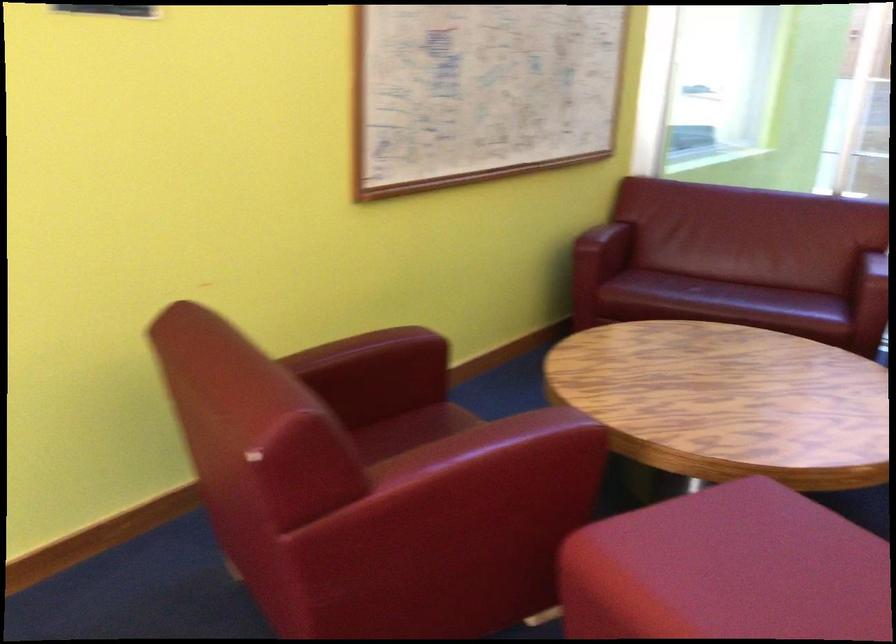
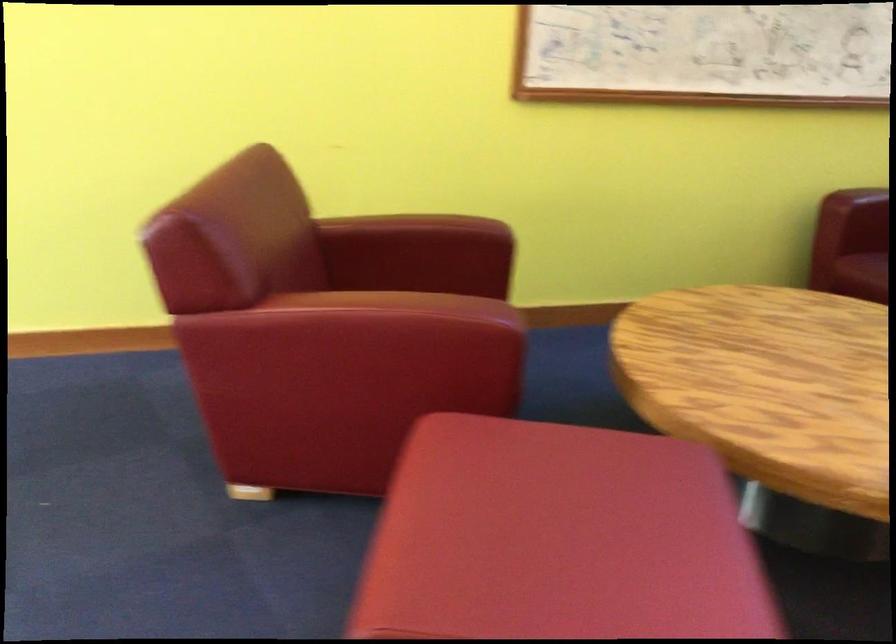
The point at (366, 355) is marked in the first image. Where is the corresponding point in the second image?

(411, 232)